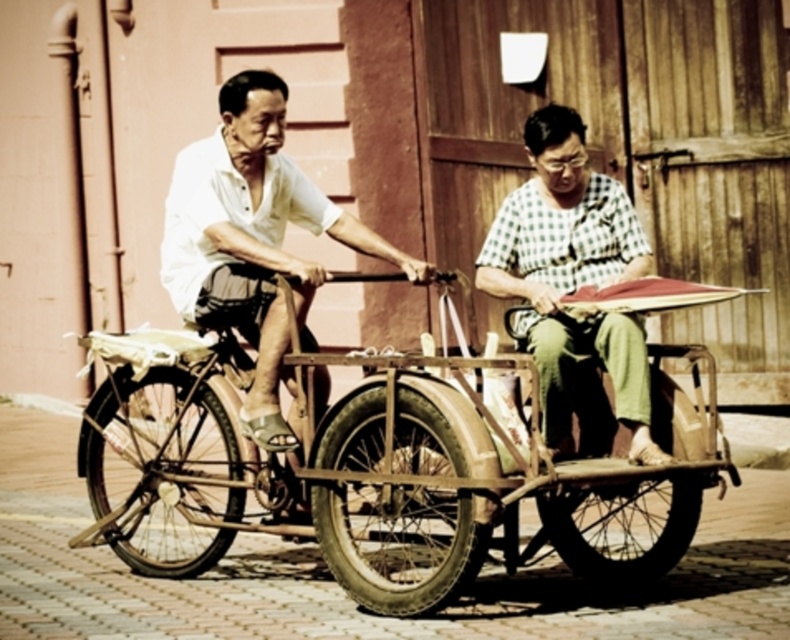
You are a passenger on a tricycle cart and need to place a small backpack on the platform. The platform has two items already present. The white cotton shirt at center and the metallic brown bicycle at center. Where should you place the backpack so it doesn

The white cotton shirt at center is positioned on the right side of metallic brown bicycle at center. Therefore, to place the backpack, you should put it on the left side of the metallic brown bicycle at center to avoid overlapping with the shirt.

You are standing at the point with coordinates (172,461). You want to move towards the tricycle cart in the image. Which direction should you go to reach the tricycle cart?

The point at (172,461) is the metallic brown bicycle at center, so to reach the tricycle cart, you should move away from the metallic brown bicycle at center towards the tricycle cart.

You are a delivery person who needs to carry a heavy package. You see the white cotton shirt at center and the metallic brown bicycle at center. Which object can support the package better?

The metallic brown bicycle at center can support the package better because it is thicker than the white cotton shirt at center.